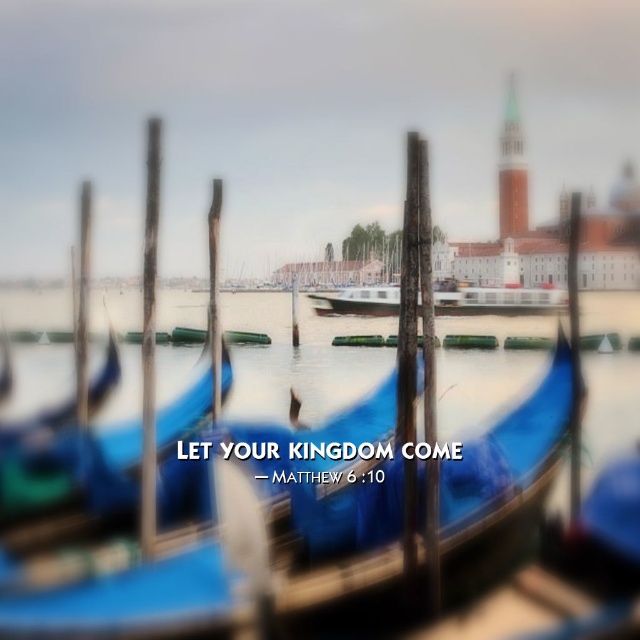
Question: Considering the relative positions of blue polished wood gondola at center and white glossy boat at center in the image provided, where is blue polished wood gondola at center located with respect to white glossy boat at center?

Choices:
 (A) above
 (B) below

Answer: (B)

Question: Is blue polished wood gondola at center bigger than white glossy boat at center?

Choices:
 (A) no
 (B) yes

Answer: (B)

Question: Can you confirm if blue polished wood gondola at center is positioned below white glossy boat at center?

Choices:
 (A) no
 (B) yes

Answer: (B)

Question: Which of the following is the farthest from the observer?

Choices:
 (A) blue polished wood gondola at center
 (B) white glossy boat at center

Answer: (B)